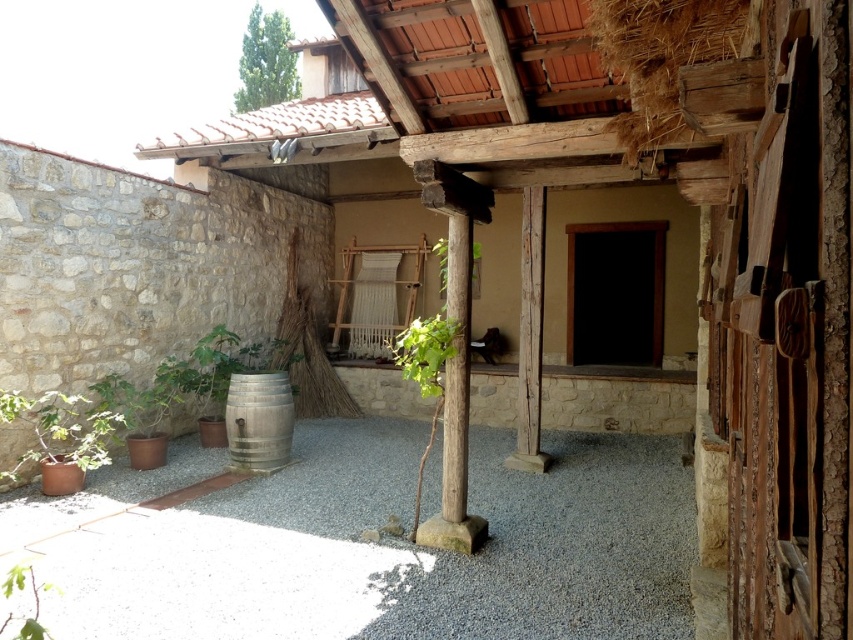
In the scene shown: Does terracotta pot at lower left appear under green leafy plant at lower left?

Incorrect, terracotta pot at lower left is not positioned below green leafy plant at lower left.

Is terracotta pot at lower left to the left of green leafy plant at lower left from the viewer's perspective?

Correct, you'll find terracotta pot at lower left to the left of green leafy plant at lower left.

The height and width of the screenshot is (640, 853). I want to click on terracotta pot at lower left, so click(x=61, y=438).

Image resolution: width=853 pixels, height=640 pixels. What are the coordinates of `terracotta pot at lower left` in the screenshot? It's located at (61, 438).

Can you confirm if green leafy plant at center is wider than green leafy plant at lower left?

Incorrect, green leafy plant at center's width does not surpass green leafy plant at lower left's.

Between point (433, 419) and point (9, 612), which one is positioned in front?

Point (9, 612) is more forward.

Who is more distant from viewer, [421,352] or [32,572]?

The point [421,352] is behind.

Find the location of a particular element. green leafy plant at center is located at coordinates (428, 362).

Is gray gravel at lower center bigger than terracotta pot at lower left?

Incorrect, gray gravel at lower center is not larger than terracotta pot at lower left.

Does gray gravel at lower center have a lesser height compared to terracotta pot at lower left?

Correct, gray gravel at lower center is not as tall as terracotta pot at lower left.

Locate an element on the screen. gray gravel at lower center is located at coordinates (366, 545).